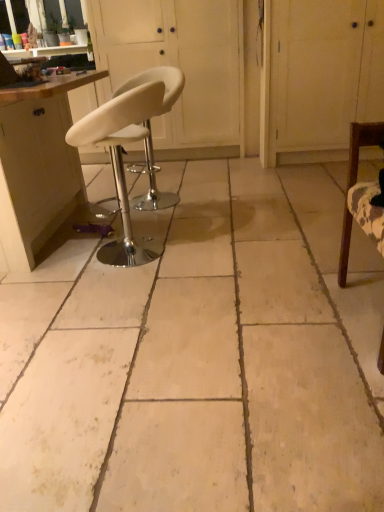
The height and width of the screenshot is (512, 384). What are the coordinates of `white leather stool at center, the first screen door from the left` in the screenshot? It's located at (178, 63).

Where is `white leather stool at center, the 2th chair when ordered from front to back`? The height and width of the screenshot is (512, 384). white leather stool at center, the 2th chair when ordered from front to back is located at coordinates (121, 162).

What are the coordinates of `wooden chair at right, which ranks as the third chair in back-to-front order` in the screenshot? It's located at (361, 145).

You are a GUI agent. You are given a task and a screenshot of the screen. Output one action in this format:
    pyautogui.click(x=<x>, y=<y>)
    Task: Click on the beige tile floor at center
    This screenshot has height=512, width=384.
    Given the screenshot: What is the action you would take?
    pyautogui.click(x=200, y=358)

Is white leather stool at center, positioned as the first chair in back-to-front order, far away from white wood cabinet at upper right, positioned as the 2th screen door in left-to-right order?

Yes, white leather stool at center, positioned as the first chair in back-to-front order, and white wood cabinet at upper right, positioned as the 2th screen door in left-to-right order, are located far from each other.

Can you confirm if white leather stool at center, which is counted as the 2th chair, starting from the right, is positioned to the left of white wood cabinet at upper right, positioned as the 2th screen door in left-to-right order?

Correct, you'll find white leather stool at center, which is counted as the 2th chair, starting from the right, to the left of white wood cabinet at upper right, positioned as the 2th screen door in left-to-right order.

From the image's perspective, is white leather stool at center, positioned as the first chair in back-to-front order, on top of white wood cabinet at upper right, positioned as the 2th screen door in left-to-right order?

No, from the image's perspective, white leather stool at center, positioned as the first chair in back-to-front order, is not above white wood cabinet at upper right, positioned as the 2th screen door in left-to-right order.

Is beige tile floor at center bigger or smaller than white leather stool at center, the first screen door from the left?

Clearly, beige tile floor at center is smaller in size than white leather stool at center, the first screen door from the left.

Based on the photo, is the depth of beige tile floor at center less than that of white leather stool at center, placed as the second screen door when sorted from right to left?

Yes.

Considering the relative sizes of beige tile floor at center and white leather stool at center, the first screen door from the left, in the image provided, is beige tile floor at center wider than white leather stool at center, the first screen door from the left,?

Indeed, beige tile floor at center has a greater width compared to white leather stool at center, the first screen door from the left.

Considering the sizes of beige tile floor at center and white leather stool at center, the first screen door from the left, in the image, is beige tile floor at center taller or shorter than white leather stool at center, the first screen door from the left,?

Considering their sizes, beige tile floor at center has less height than white leather stool at center, the first screen door from the left.

Is point (24, 234) positioned after point (25, 336)?

Yes.

From a real-world perspective, is matte wood cabinet at left under beige tile floor at center?

No, from a real-world perspective, matte wood cabinet at left is not below beige tile floor at center.

Between matte wood cabinet at left and beige tile floor at center, which one has smaller width?

Thinner between the two is matte wood cabinet at left.

Considering the positions of objects beige tile floor at center and white wood cabinet at upper right, the 1th screen door viewed from the right, in the image provided, who is in front, beige tile floor at center or white wood cabinet at upper right, the 1th screen door viewed from the right,?

beige tile floor at center is more forward.

How different are the orientations of beige tile floor at center and white wood cabinet at upper right, the 1th screen door viewed from the right, in degrees?

89.5 degrees.

Image resolution: width=384 pixels, height=512 pixels. In order to click on concrete in front of the white wood cabinet at upper right, positioned as the 2th screen door in left-to-right order in this screenshot , I will do `click(200, 358)`.

Does white wood cabinet at upper right, positioned as the 2th screen door in left-to-right order, have a greater width compared to white leather stool at center, acting as the 1th chair starting from the left?

Correct, the width of white wood cabinet at upper right, positioned as the 2th screen door in left-to-right order, exceeds that of white leather stool at center, acting as the 1th chair starting from the left.

From the image's perspective, which is below, white wood cabinet at upper right, positioned as the 2th screen door in left-to-right order, or white leather stool at center, arranged as the 2th chair when viewed from the back?

white leather stool at center, arranged as the 2th chair when viewed from the back.

From a real-world perspective, who is located lower, white wood cabinet at upper right, the 1th screen door viewed from the right, or white leather stool at center, the 2th chair when ordered from front to back?

In real-world perspective, white leather stool at center, the 2th chair when ordered from front to back, is lower.

Does beige tile floor at center have a greater height compared to white leather stool at center, the 2th chair when ordered from front to back?

No.

Could you measure the distance between beige tile floor at center and white leather stool at center, the 3th chair positioned from the right?

beige tile floor at center and white leather stool at center, the 3th chair positioned from the right, are 26.43 inches apart from each other.

Between beige tile floor at center and white leather stool at center, arranged as the 2th chair when viewed from the back, which one has larger size?

With larger size is beige tile floor at center.

Is beige tile floor at center beside white leather stool at center, the 2th chair when ordered from front to back?

beige tile floor at center and white leather stool at center, the 2th chair when ordered from front to back, are not in contact.

Does point (227, 4) come closer to viewer compared to point (280, 27)?

That is False.

Which object is closer to the camera, white leather stool at center, placed as the second screen door when sorted from right to left, or white wood cabinet at upper right, the 1th screen door viewed from the right?

Positioned in front is white wood cabinet at upper right, the 1th screen door viewed from the right.

Is white leather stool at center, placed as the second screen door when sorted from right to left, next to white wood cabinet at upper right, the 1th screen door viewed from the right?

white leather stool at center, placed as the second screen door when sorted from right to left, and white wood cabinet at upper right, the 1th screen door viewed from the right, are not in contact.

From the image's perspective, is white leather stool at center, placed as the second screen door when sorted from right to left, located above or below white wood cabinet at upper right, the 1th screen door viewed from the right?

Based on their image positions, white leather stool at center, placed as the second screen door when sorted from right to left, is located above white wood cabinet at upper right, the 1th screen door viewed from the right.

You are a GUI agent. You are given a task and a screenshot of the screen. Output one action in this format:
    pyautogui.click(x=<x>, y=<y>)
    Task: Click on the screen door that is the 1st one when counting upward from the white leather stool at center, which is counted as the 2th chair, starting from the right (from the image's perspective)
    
    Given the screenshot: What is the action you would take?
    pyautogui.click(x=323, y=74)

Locate an element on the screen. Image resolution: width=384 pixels, height=512 pixels. concrete beneath the white leather stool at center, the first screen door from the left (from a real-world perspective) is located at coordinates (200, 358).

Considering their positions, is matte wood cabinet at left positioned further to white leather stool at center, placed as the second screen door when sorted from right to left, than white leather stool at center, acting as the 2th chair starting from the left?

The object further to white leather stool at center, placed as the second screen door when sorted from right to left, is matte wood cabinet at left.

When comparing their distances from beige tile floor at center, does white leather stool at center, arranged as the 2th chair when viewed from the back, or wooden chair at right, the third chair positioned from the left, seem closer?

white leather stool at center, arranged as the 2th chair when viewed from the back, is closer to beige tile floor at center.

When comparing their distances from white leather stool at center, acting as the 1th chair starting from the left, does matte wood cabinet at left or beige tile floor at center seem closer?

matte wood cabinet at left is positioned closer to the anchor white leather stool at center, acting as the 1th chair starting from the left.

Considering their positions, is white leather stool at center, which is counted as the 2th chair, starting from the right, positioned further to matte wood cabinet at left than beige tile floor at center?

beige tile floor at center.

Which object lies further to the anchor point white leather stool at center, acting as the 2th chair starting from the left, matte wood cabinet at left or wooden chair at right, the first chair when ordered from front to back?

Based on the image, wooden chair at right, the first chair when ordered from front to back, appears to be further to white leather stool at center, acting as the 2th chair starting from the left.

Which object lies nearer to the anchor point white leather stool at center, the 3th chair positioned from the right, white wood cabinet at upper right, the 1th screen door viewed from the right, or white leather stool at center, the first screen door from the left?

The object closer to white leather stool at center, the 3th chair positioned from the right, is white leather stool at center, the first screen door from the left.

Looking at the image, which one is located closer to white leather stool at center, placed as the second screen door when sorted from right to left, white leather stool at center, arranged as the 2th chair when viewed from the back, or white wood cabinet at upper right, positioned as the 2th screen door in left-to-right order?

white wood cabinet at upper right, positioned as the 2th screen door in left-to-right order, is closer to white leather stool at center, placed as the second screen door when sorted from right to left.

Looking at the image, which one is located further to matte wood cabinet at left, wooden chair at right, which ranks as the third chair in back-to-front order, or white leather stool at center, positioned as the first chair in back-to-front order?

A: wooden chair at right, which ranks as the third chair in back-to-front order.

Locate an element on the screen. The height and width of the screenshot is (512, 384). screen door between matte wood cabinet at left and white wood cabinet at upper right, the 1th screen door viewed from the right, from left to right is located at coordinates (178, 63).

The image size is (384, 512). In order to click on chair positioned between white leather stool at center, the 2th chair when ordered from front to back, and white leather stool at center, the first screen door from the left, from near to far in this screenshot , I will do `click(151, 181)`.

At what (x,y) coordinates should I click in order to perform the action: click on screen door positioned between wooden chair at right, the third chair positioned from the left, and white leather stool at center, the first screen door from the left, from near to far. Please return your answer as a coordinate pair (x, y). Looking at the image, I should click on (323, 74).

The width and height of the screenshot is (384, 512). What are the coordinates of `screen door between white leather stool at center, the third chair positioned from the front, and white wood cabinet at upper right, positioned as the 2th screen door in left-to-right order, in the horizontal direction` in the screenshot? It's located at (178, 63).